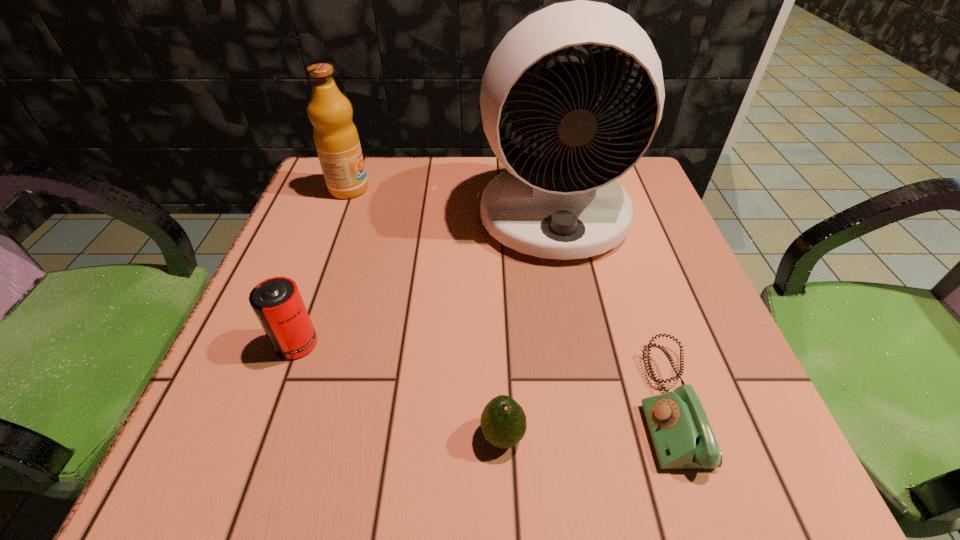
The height and width of the screenshot is (540, 960). I want to click on free location located 0.400m on the dial of the telephone, so click(x=359, y=403).

Find the location of a particular element. Image resolution: width=960 pixels, height=540 pixels. free space located 0.100m on the dial of the telephone is located at coordinates (569, 403).

This screenshot has height=540, width=960. Identify the location of fan at the far edge. (565, 206).

Locate an element on the screen. The width and height of the screenshot is (960, 540). fruit juice that is at the far edge is located at coordinates (336, 139).

Locate an element on the screen. avocado at the near edge is located at coordinates (503, 422).

Where is `telephone that is at the near edge`? telephone that is at the near edge is located at coordinates [681, 434].

At what (x,y) coordinates should I click in order to perform the action: click on fruit juice that is positioned at the left edge. Please return your answer as a coordinate pair (x, y). Looking at the image, I should click on (336, 139).

Where is `can at the left edge`? The width and height of the screenshot is (960, 540). can at the left edge is located at coordinates tap(277, 303).

Find the location of `fan that is at the right edge`. fan that is at the right edge is located at coordinates coord(565,206).

Image resolution: width=960 pixels, height=540 pixels. In order to click on telephone that is positioned at the right edge in this screenshot , I will do coord(681,434).